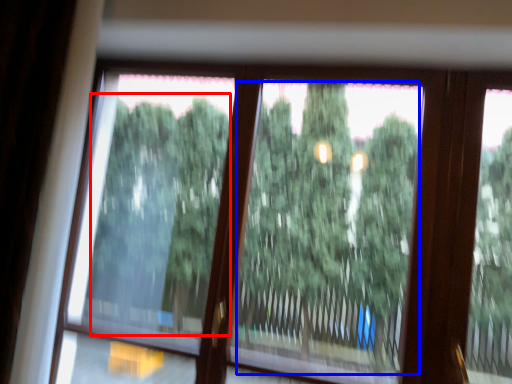
Question: Which point is further to the camera, tree (highlighted by a red box) or tree (highlighted by a blue box)?

Choices:
 (A) tree
 (B) tree

Answer: (A)